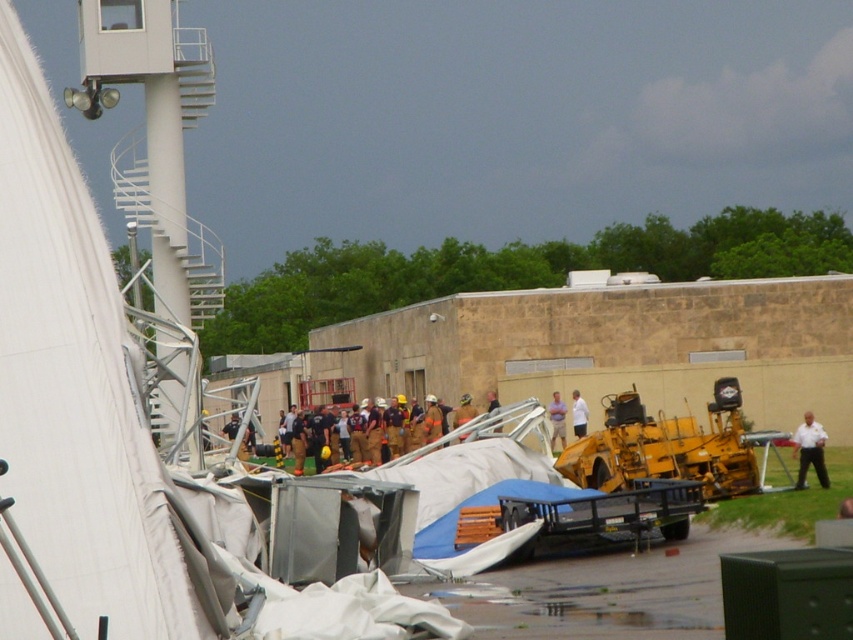
Question: Does light blue shirt at center appear on the left side of light brown leather jacket at center?

Choices:
 (A) no
 (B) yes

Answer: (A)

Question: Which object appears farthest from the camera in this image?

Choices:
 (A) white uniform at right
 (B) brown uniform at center

Answer: (A)

Question: Which object is closer to the camera taking this photo?

Choices:
 (A) black uniformed person at center
 (B) white fabric at center
 (C) white uniform at right
 (D) brown uniform at center

Answer: (A)

Question: Can you confirm if brown uniform at center is positioned to the left of light blue shirt at center?

Choices:
 (A) no
 (B) yes

Answer: (B)

Question: Among these objects, which one is farthest from the camera?

Choices:
 (A) white uniform at right
 (B) black uniformed person at center

Answer: (A)

Question: In this image, where is white uniform at right located relative to white fabric at center?

Choices:
 (A) left
 (B) right

Answer: (B)